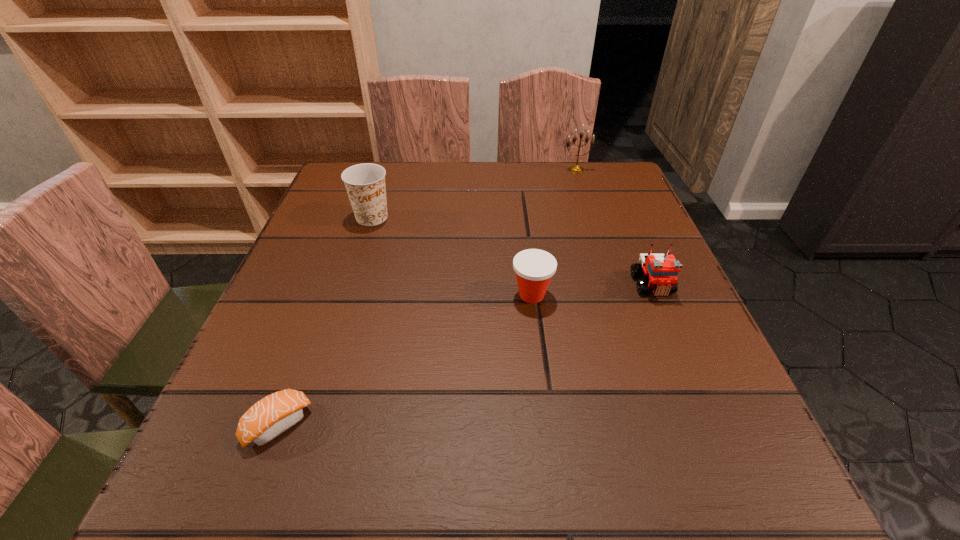
Find the location of a particular element. This screenshot has width=960, height=540. unoccupied position between the nearer Dixie cup and the sushi is located at coordinates (405, 360).

This screenshot has height=540, width=960. Find the location of `vacant point located between the shorter Dixie cup and the second farthest object`. vacant point located between the shorter Dixie cup and the second farthest object is located at coordinates (452, 256).

Identify the location of free space between the fourth object from left to right and the Lego. The image size is (960, 540). (614, 227).

You are a GUI agent. You are given a task and a screenshot of the screen. Output one action in this format:
    pyautogui.click(x=<x>, y=<y>)
    Task: Click on the vacant area between the shorter Dixie cup and the sushi
    Image resolution: width=960 pixels, height=540 pixels.
    Given the screenshot: What is the action you would take?
    pyautogui.click(x=405, y=360)

Locate an element on the screen. The height and width of the screenshot is (540, 960). vacant space in between the sushi and the second object from right to left is located at coordinates (427, 298).

The height and width of the screenshot is (540, 960). I want to click on free point between the second object from right to left and the shorter Dixie cup, so click(x=554, y=232).

Where is `free space that is in between the candelabrum and the taller Dixie cup`? free space that is in between the candelabrum and the taller Dixie cup is located at coordinates (474, 193).

Locate an element on the screen. vacant space in between the nearer Dixie cup and the Lego is located at coordinates (592, 290).

Find the location of a particular element. free space between the shorter Dixie cup and the fourth object from left to right is located at coordinates (554, 232).

I want to click on free point between the Lego and the third object from left to right, so click(x=592, y=290).